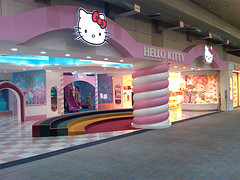
Image resolution: width=240 pixels, height=180 pixels. Identify the location of doorframe. (11, 86).